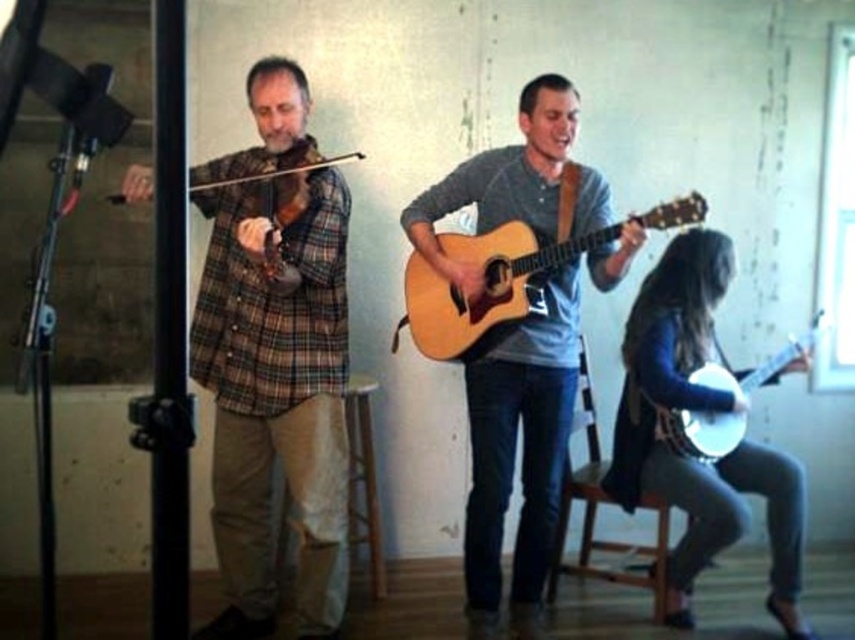
Question: Does matte brown guitar at center have a lesser width compared to wooden violin at left?

Choices:
 (A) no
 (B) yes

Answer: (A)

Question: Estimate the real-world distances between objects in this image. Which object is closer to the wooden violin at left?

Choices:
 (A) acoustic wood guitar at center
 (B) leather banjo at lower right
 (C) white glossy banjo at lower right

Answer: (A)

Question: Can you confirm if brown plaid shirt at left is bigger than leather banjo at lower right?

Choices:
 (A) yes
 (B) no

Answer: (A)

Question: Which object is farther from the camera taking this photo?

Choices:
 (A) matte brown guitar at center
 (B) leather banjo at lower right
 (C) wooden violin at left
 (D) brown plaid shirt at left

Answer: (B)

Question: Which point is farther to the camera?

Choices:
 (A) (556, 548)
 (B) (360, 154)
 (C) (286, 518)
 (D) (540, 273)

Answer: (B)

Question: Is the position of matte brown guitar at center less distant than that of white glossy banjo at lower right?

Choices:
 (A) yes
 (B) no

Answer: (A)